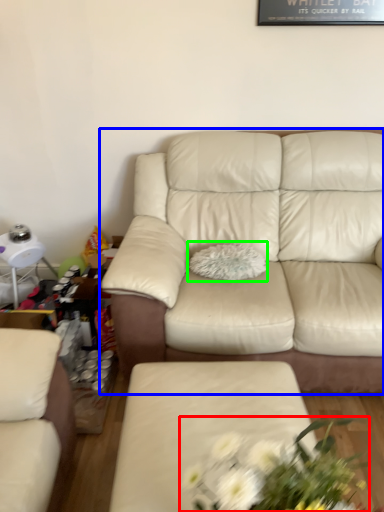
Question: Based on their relative distances, which object is farther from floral arrangement (highlighted by a red box)? Choose from studio couch (highlighted by a blue box) and pillow (highlighted by a green box).

Choices:
 (A) studio couch
 (B) pillow

Answer: (B)